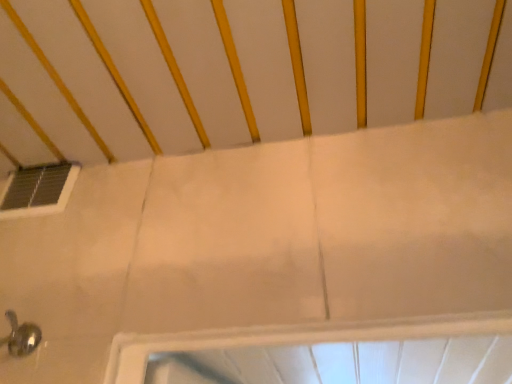
Question: Based on their sizes in the image, would you say transparent glass window at upper left is bigger or smaller than white matte infant bed at upper center?

Choices:
 (A) small
 (B) big

Answer: (A)

Question: From the image's perspective, relative to white matte infant bed at upper center, is transparent glass window at upper left above or below?

Choices:
 (A) above
 (B) below

Answer: (B)

Question: Considering the positions of point (52, 165) and point (501, 44), is point (52, 165) closer or farther from the camera than point (501, 44)?

Choices:
 (A) farther
 (B) closer

Answer: (A)

Question: Is point 421,38 closer or farther from the camera than point 39,188?

Choices:
 (A) farther
 (B) closer

Answer: (B)

Question: Is white matte infant bed at upper center inside the boundaries of transparent glass window at upper left, or outside?

Choices:
 (A) outside
 (B) inside

Answer: (A)

Question: Is white matte infant bed at upper center bigger or smaller than transparent glass window at upper left?

Choices:
 (A) big
 (B) small

Answer: (A)

Question: From a real-world perspective, is white matte infant bed at upper center above or below transparent glass window at upper left?

Choices:
 (A) above
 (B) below

Answer: (A)